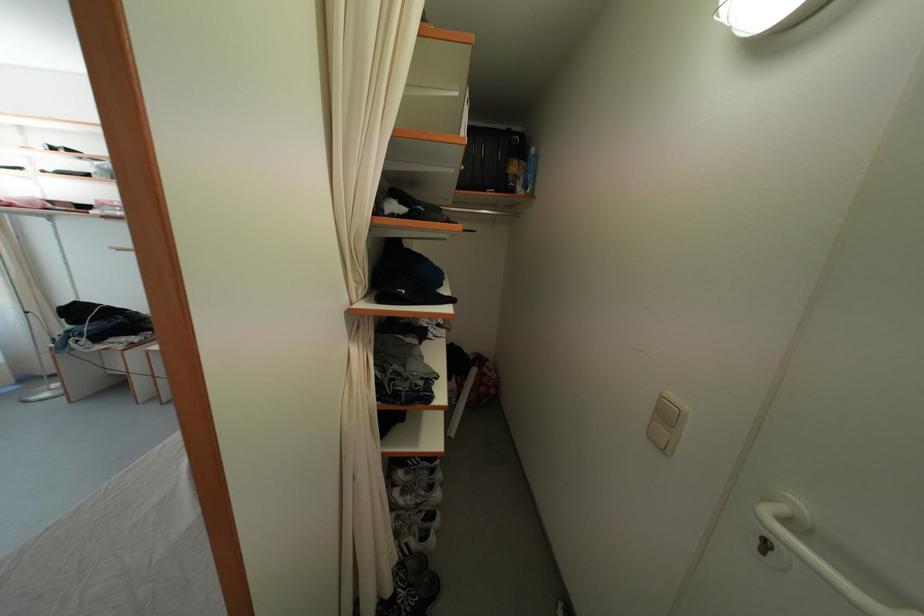
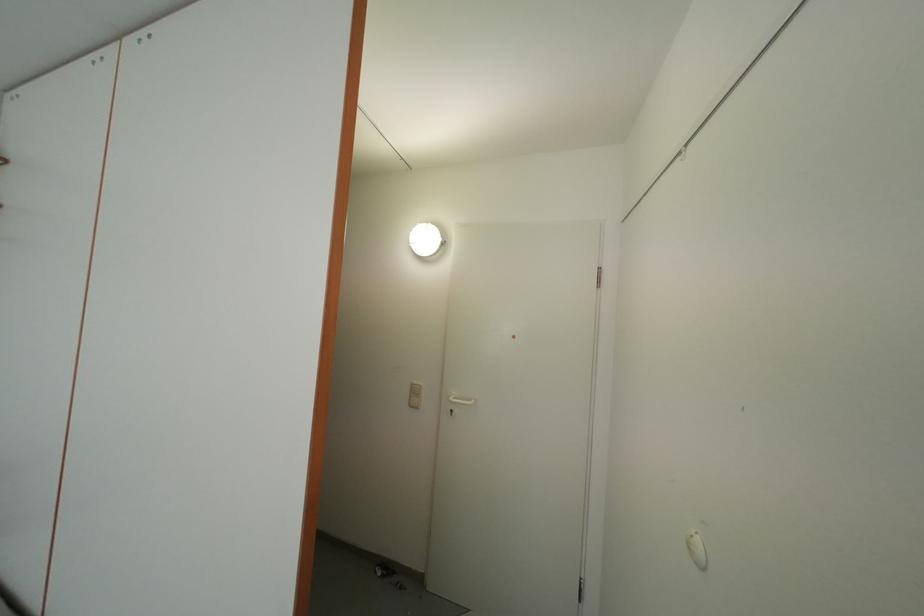
Where in the second image is the point corresponding to (x=675, y=400) from the first image?

(420, 387)